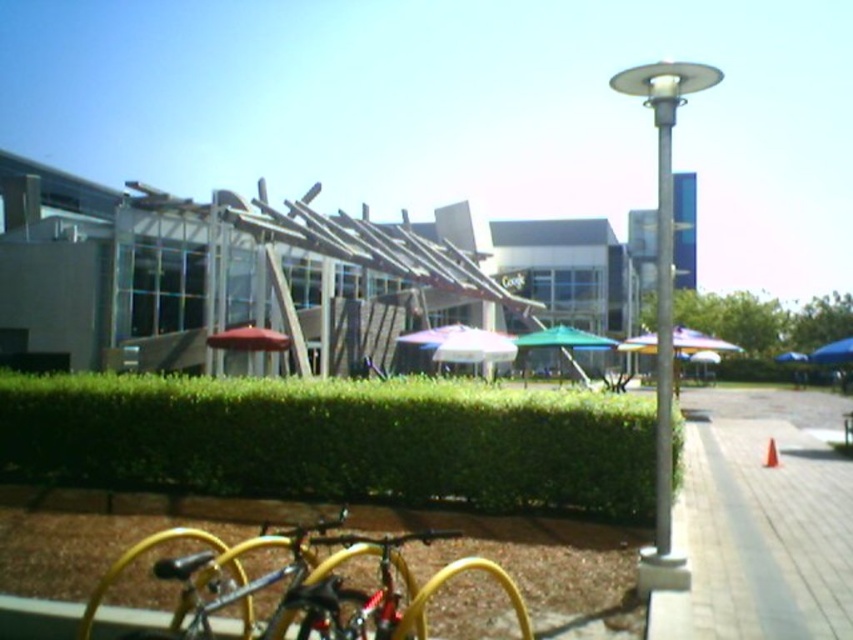
Who is higher up, yellow matte bicycle at lower left or red fabric umbrella at center?

red fabric umbrella at center

Does point (291, 586) lie in front of point (233, 344)?

Yes, it is.

What are the coordinates of `yellow matte bicycle at lower left` in the screenshot? It's located at (300, 582).

Can you confirm if yellow matte bicycle at lower left is positioned below silver metallic pole at center-right?

Indeed, yellow matte bicycle at lower left is positioned under silver metallic pole at center-right.

Which of these two, yellow matte bicycle at lower left or silver metallic pole at center-right, stands shorter?

yellow matte bicycle at lower left is shorter.

Who is more forward, (386, 627) or (662, 148)?

Point (386, 627)

At what (x,y) coordinates should I click in order to perform the action: click on yellow matte bicycle at lower left. Please return your answer as a coordinate pair (x, y). Looking at the image, I should click on (300, 582).

Is point (741, 508) closer to viewer compared to point (538, 337)?

Yes, it is.

The width and height of the screenshot is (853, 640). I want to click on gray concrete pavement at lower right, so click(759, 522).